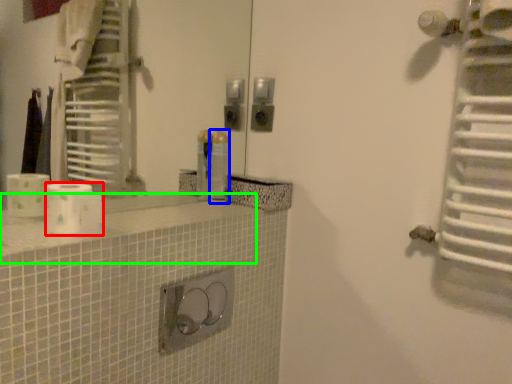
Question: Which object is positioned farthest from toilet paper (highlighted by a red box)? Select from toiletry (highlighted by a blue box) and counter top (highlighted by a green box).

Choices:
 (A) toiletry
 (B) counter top

Answer: (A)